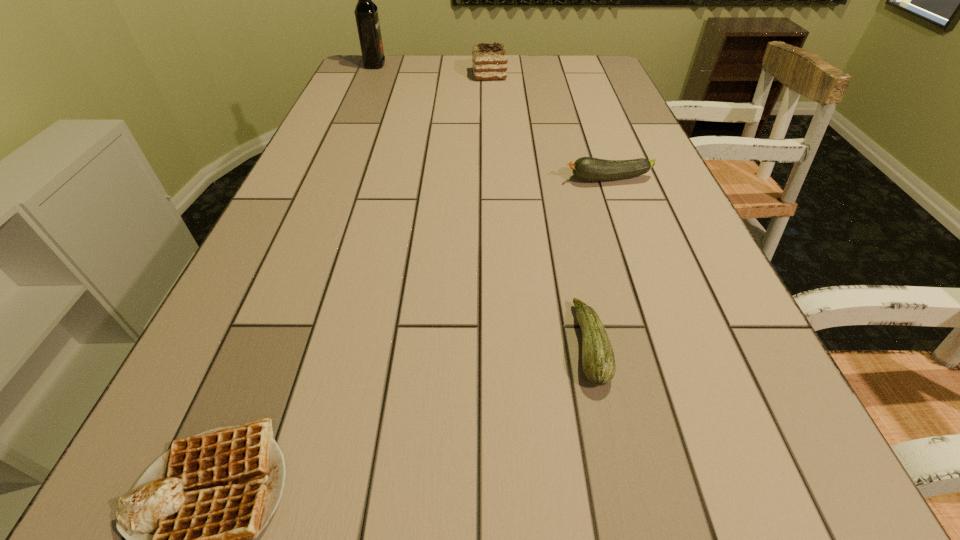
You are a GUI agent. You are given a task and a screenshot of the screen. Output one action in this format:
    pyautogui.click(x=<x>, y=<y>)
    Task: Click on the vacant space that satisfies the following two spatial constraints: 1. on the front-facing side of the chocolate cake; 2. on the right side of the liquor
    This screenshot has width=960, height=540.
    Given the screenshot: What is the action you would take?
    pyautogui.click(x=371, y=75)

Image resolution: width=960 pixels, height=540 pixels. Identify the location of blank area in the image that satisfies the following two spatial constraints: 1. on the front-facing side of the liquor; 2. on the back side of the chocolate cake. (371, 75).

Where is `free space in the image that satisfies the following two spatial constraints: 1. on the front-facing side of the liquor; 2. on the right side of the third object from right to left`? free space in the image that satisfies the following two spatial constraints: 1. on the front-facing side of the liquor; 2. on the right side of the third object from right to left is located at coordinates (371, 75).